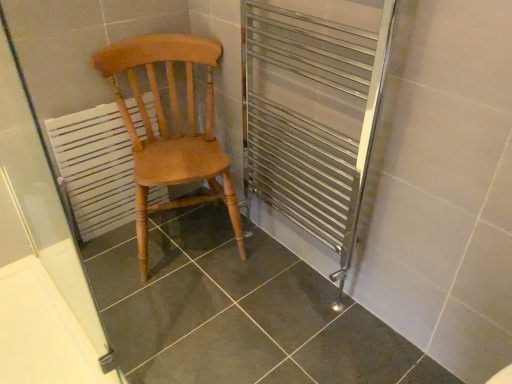
I want to click on vacant area to the right of white painted wood radiator at left, so (x=179, y=231).